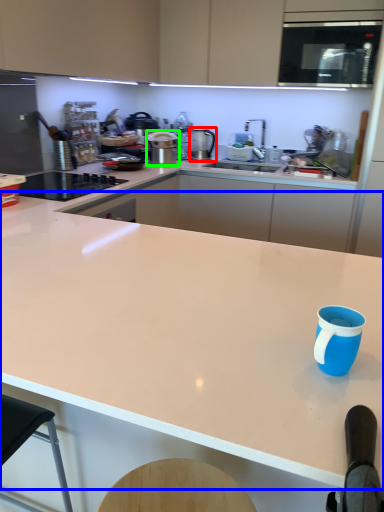
Question: Which is farther away from kitchen appliance (highlighted by a red box)? countertop (highlighted by a blue box) or kitchen appliance (highlighted by a green box)?

Choices:
 (A) countertop
 (B) kitchen appliance

Answer: (A)